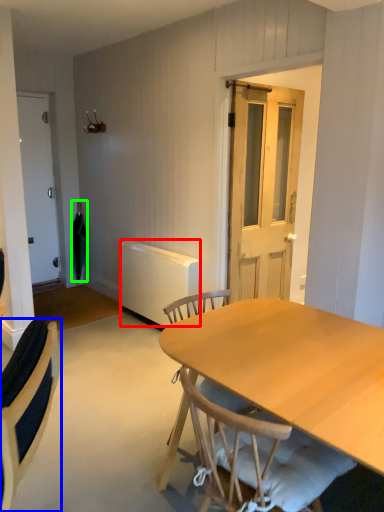
Question: Based on their relative distances, which object is nearer to radiator (highlighted by a red box)? Choose from chair (highlighted by a blue box) and umbrella (highlighted by a green box).

Choices:
 (A) chair
 (B) umbrella

Answer: (B)